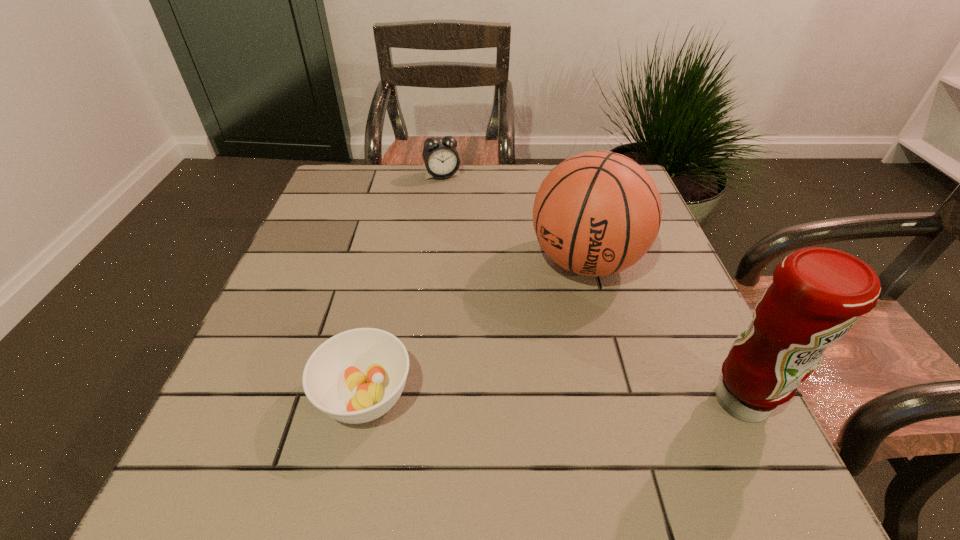
You are a GUI agent. You are given a task and a screenshot of the screen. Output one action in this format:
    pyautogui.click(x=<x>, y=<y>)
    Task: Click on the blank area in the image that satisfies the following two spatial constraints: 1. on the front side of the second farthest object; 2. on the left side of the rightmost object
    
    Given the screenshot: What is the action you would take?
    pyautogui.click(x=622, y=401)

Find the location of a particular element. Image resolution: width=960 pixels, height=540 pixels. free location that satisfies the following two spatial constraints: 1. on the back side of the shortest object; 2. on the left side of the second farthest object is located at coordinates (395, 261).